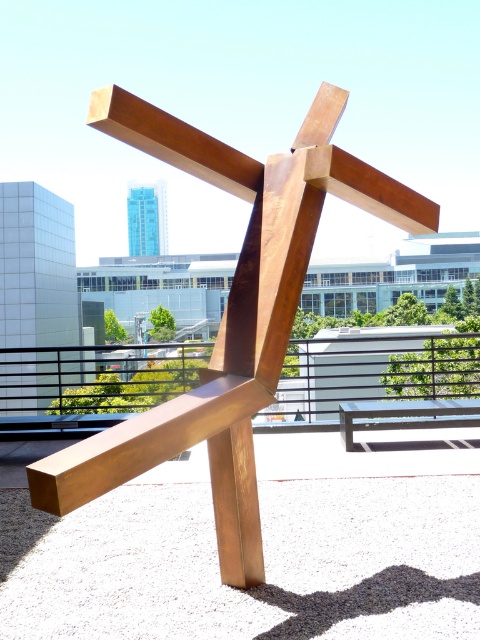
You are an urban planner designing a new rooftop garden and want to place a new bench that is the same size as the wooden park bench at center. Given that the satin brown railing at center is currently occupying the central area, can the bench be placed in the same location without overlapping the railing?

The satin brown railing at center has a larger size compared to the wooden park bench at center. Since the bench is smaller, it can be placed in the same location without overlapping the railing as long as there is enough space around the railing.

You are an architect inspecting the rooftop platform. You need to determine the placement of a new bench. The bench must be placed to the left of the satin brown railing at center. Can the bronze metallic sculpture at center be placed in the current location if the bench is placed as required?

The bronze metallic sculpture at center is currently to the right of the satin brown railing at center. If the bench is placed to the left of the satin brown railing at center, the sculpture can remain in its current position since it is already on the right side of the railing.

You are a photographer trying to capture the sculpture from your current position. You notice two points on the sculpture labeled as point (60, 460) and point (415, 403). Which point will appear larger in your photo?

Point (60, 460) is closer to the camera than point (415, 403), so it will appear larger in the photo.